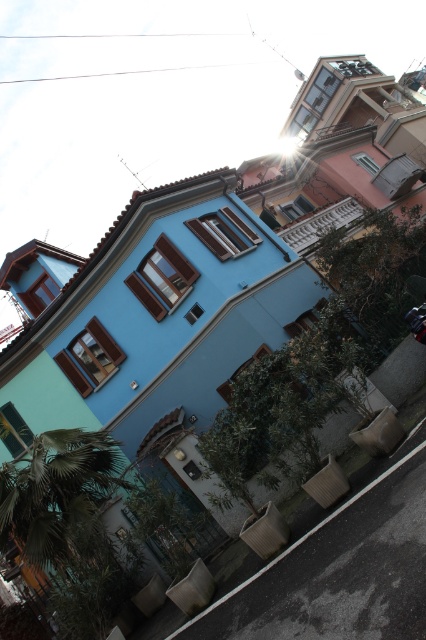
Looking at this image, you are standing at the point marked as point (60, 499) in the image. Looking around, you see the light blue house with brown window frames and the green leafy palm tree at lower left. Which object is closer to your current position?

The point (60, 499) corresponds to the green leafy palm tree at lower left, so you are currently at the location of the green leafy palm tree at lower left. Therefore, the green leafy palm tree at lower left is right where you are standing, making it the closest object to your position.

You are standing on the street in front of the light blue house with brown window frames. You see two points marked in the image. One is at coordinate point (58, 502) and the other is at point (420, 312). Which point is closer to you?

Point (58, 502) is closer to you because it is further to the viewer than point (420, 312).